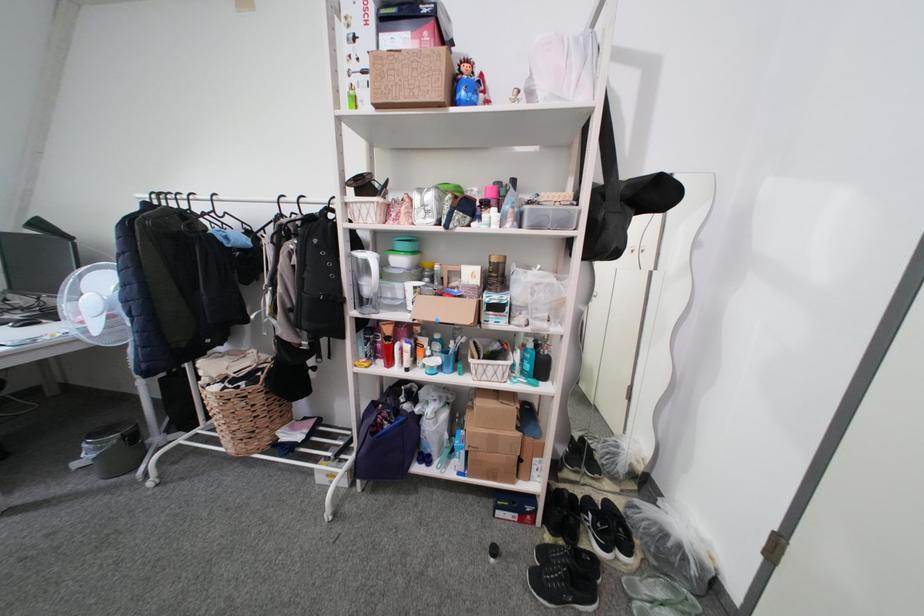
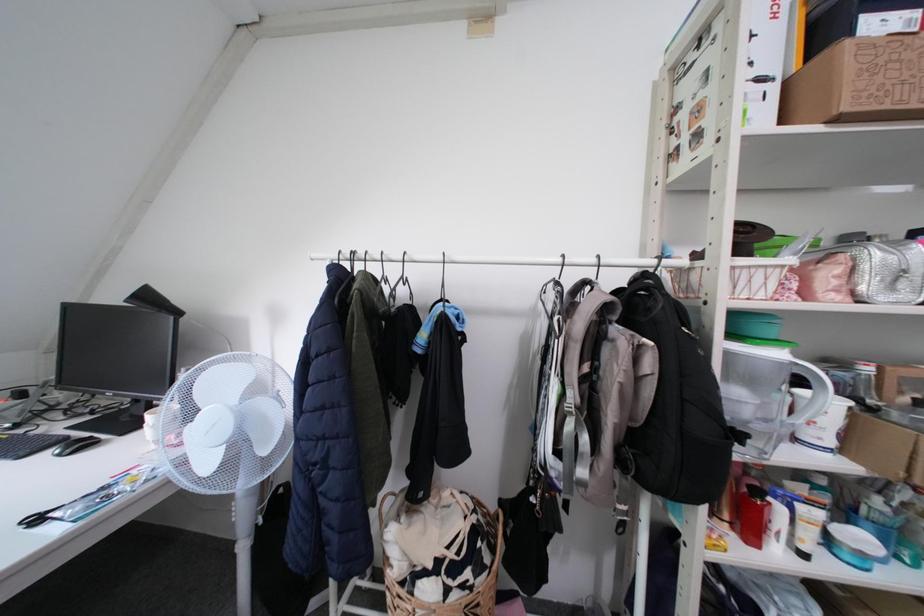
The images are taken continuously from a first-person perspective. In which direction are you moving?

The movement direction of the cameraman is left, forward.